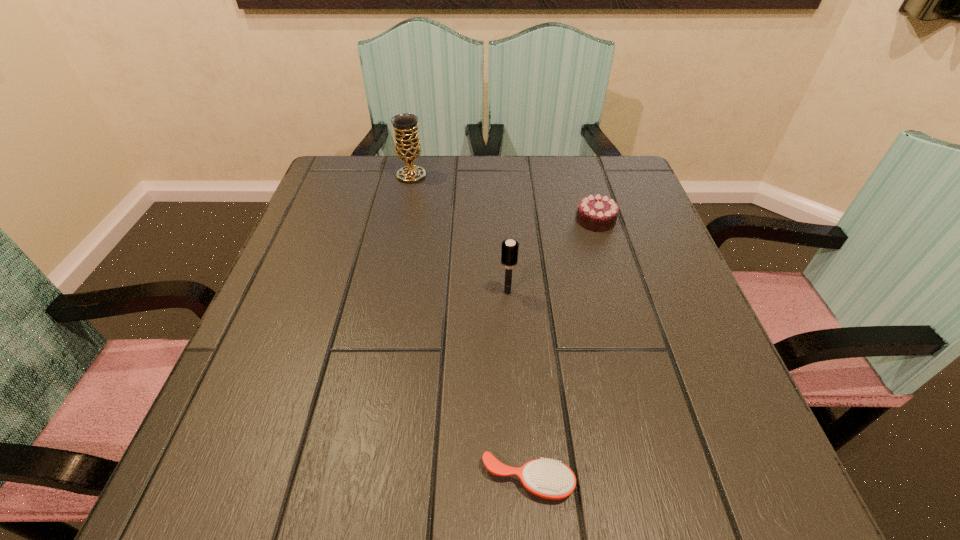
Identify the location of vacant space at the far left corner. The height and width of the screenshot is (540, 960). (365, 181).

Where is `vacant space at the far right corner`? The image size is (960, 540). vacant space at the far right corner is located at coordinates (590, 190).

Locate an element on the screen. vacant space at the near right corner is located at coordinates (760, 481).

Where is `free space between the shorter hairbrush and the third nearest object`? free space between the shorter hairbrush and the third nearest object is located at coordinates (562, 350).

Identify the location of free space between the shortest object and the chocolate cake. (562, 350).

I want to click on free space between the nearest object and the third farthest object, so click(517, 386).

Find the location of `free spot between the shortest object and the rightmost object`. free spot between the shortest object and the rightmost object is located at coordinates (562, 350).

In order to click on free space between the chocolate cake and the leftmost object in this screenshot , I will do `click(503, 198)`.

The image size is (960, 540). Identify the location of free space between the farthest object and the rightmost object. (503, 198).

Find the location of `unoccupied position between the second farthest object and the farther hairbrush`. unoccupied position between the second farthest object and the farther hairbrush is located at coordinates (551, 256).